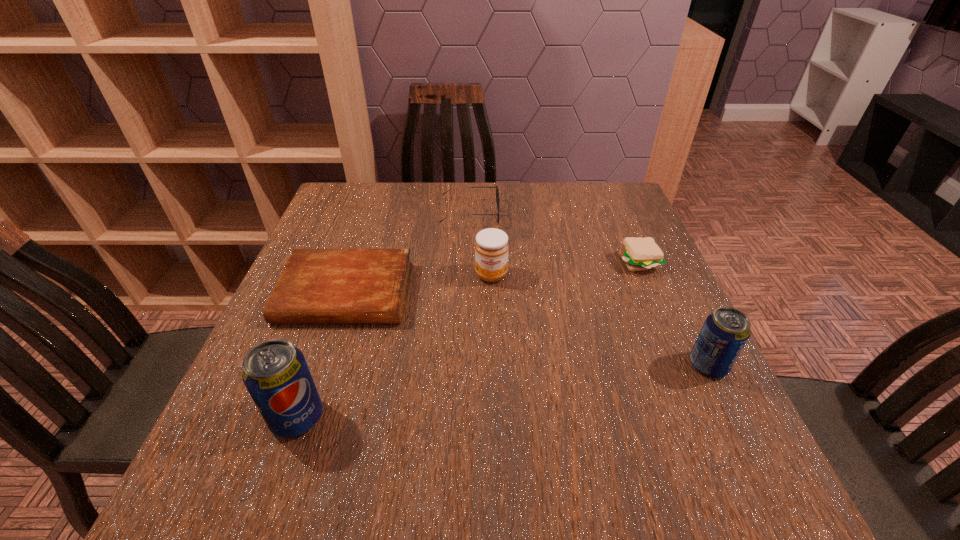
Identify the location of empty space between the fifth farthest object and the patty. The width and height of the screenshot is (960, 540). pos(673,314).

Where is `vacant area between the left soda and the third tallest object`? vacant area between the left soda and the third tallest object is located at coordinates (395, 346).

Locate an element on the screen. The height and width of the screenshot is (540, 960). unoccupied area between the jam and the Bible is located at coordinates (419, 284).

I want to click on empty space between the nearest object and the fourth shortest object, so click(395, 346).

Where is `free space that is in between the tallest object and the patty`? The image size is (960, 540). free space that is in between the tallest object and the patty is located at coordinates (468, 339).

The width and height of the screenshot is (960, 540). Identify the location of object that is the fifth closest to the Bible. (725, 332).

Image resolution: width=960 pixels, height=540 pixels. I want to click on the fifth closest object to the right soda, so click(x=276, y=375).

Image resolution: width=960 pixels, height=540 pixels. Find the location of `vacant region that satisfies the following two spatial constraints: 1. on the spine side of the second nearest object; 2. on the right side of the Bible`. vacant region that satisfies the following two spatial constraints: 1. on the spine side of the second nearest object; 2. on the right side of the Bible is located at coordinates (322, 365).

This screenshot has height=540, width=960. Identify the location of vacant space that satisfies the following two spatial constraints: 1. through the lenses of the farthest object; 2. on the left side of the patty. (468, 262).

This screenshot has height=540, width=960. I want to click on vacant space that satisfies the following two spatial constraints: 1. through the lenses of the spectacles; 2. on the left side of the patty, so click(468, 262).